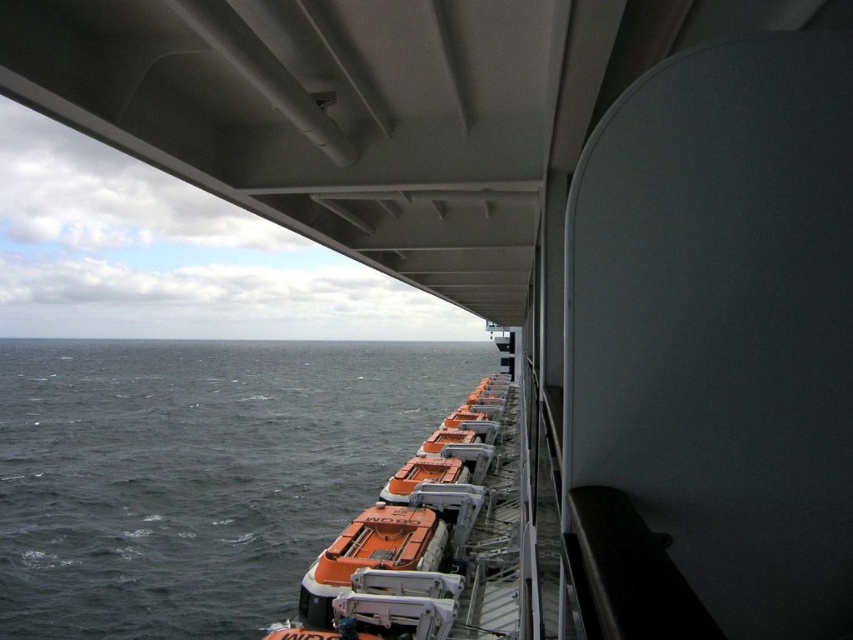
Is point (165, 442) more distant than point (425, 556)?

Yes, point (165, 442) is farther from viewer.

The height and width of the screenshot is (640, 853). What do you see at coordinates (196, 474) in the screenshot? I see `dark gray water at lower left` at bounding box center [196, 474].

What are the coordinates of `dark gray water at lower left` in the screenshot? It's located at (196, 474).